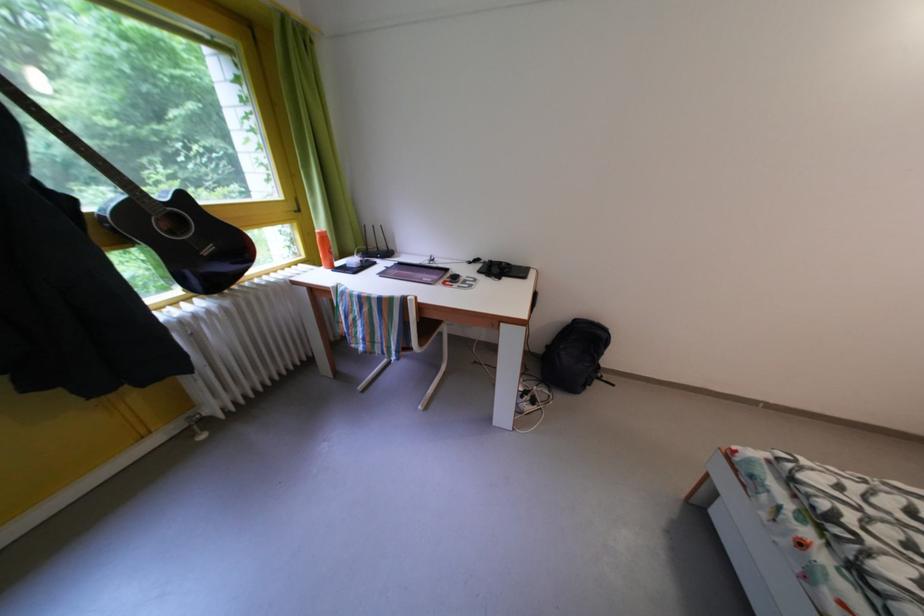
Where is `radiator control knob`? This screenshot has width=924, height=616. radiator control knob is located at coordinates (196, 334).